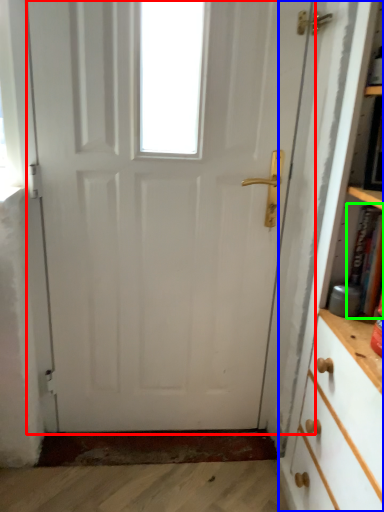
Question: Which object is positioned closest to door (highlighted by a red box)? Select from bookcase (highlighted by a blue box) and book (highlighted by a green box).

Choices:
 (A) bookcase
 (B) book

Answer: (A)